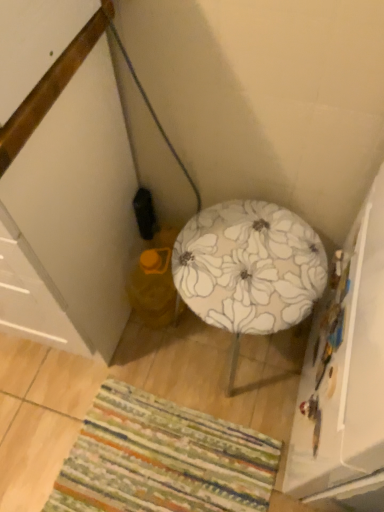
Question: Can you confirm if multicolored woven mat at lower center is thinner than floral fabric stool at center?

Choices:
 (A) yes
 (B) no

Answer: (B)

Question: From the image's perspective, does multicolored woven mat at lower center appear lower than floral fabric stool at center?

Choices:
 (A) yes
 (B) no

Answer: (A)

Question: From a real-world perspective, is multicolored woven mat at lower center on floral fabric stool at center?

Choices:
 (A) yes
 (B) no

Answer: (B)

Question: Is multicolored woven mat at lower center in front of floral fabric stool at center?

Choices:
 (A) no
 (B) yes

Answer: (A)

Question: From a real-world perspective, is multicolored woven mat at lower center under floral fabric stool at center?

Choices:
 (A) yes
 (B) no

Answer: (A)

Question: Do you think floral fabric stool at center is within multicolored woven mat at lower center, or outside of it?

Choices:
 (A) outside
 (B) inside

Answer: (A)

Question: From the image's perspective, is floral fabric stool at center above or below multicolored woven mat at lower center?

Choices:
 (A) above
 (B) below

Answer: (A)

Question: In terms of width, does floral fabric stool at center look wider or thinner when compared to multicolored woven mat at lower center?

Choices:
 (A) thin
 (B) wide

Answer: (A)

Question: In the image, is floral fabric stool at center positioned in front of or behind multicolored woven mat at lower center?

Choices:
 (A) front
 (B) behind

Answer: (A)

Question: From a real-world perspective, relative to floral fabric stool at center, is yellow fabric bean bag chair at lower left vertically above or below?

Choices:
 (A) above
 (B) below

Answer: (B)

Question: Considering the positions of yellow fabric bean bag chair at lower left and floral fabric stool at center in the image, is yellow fabric bean bag chair at lower left wider or thinner than floral fabric stool at center?

Choices:
 (A) thin
 (B) wide

Answer: (A)

Question: In the image, is yellow fabric bean bag chair at lower left positioned in front of or behind floral fabric stool at center?

Choices:
 (A) behind
 (B) front

Answer: (A)

Question: Is yellow fabric bean bag chair at lower left to the left or to the right of floral fabric stool at center in the image?

Choices:
 (A) right
 (B) left

Answer: (B)

Question: Considering the positions of white glossy cabinet at lower left and yellow fabric bean bag chair at lower left in the image, is white glossy cabinet at lower left bigger or smaller than yellow fabric bean bag chair at lower left?

Choices:
 (A) big
 (B) small

Answer: (A)

Question: From their relative heights in the image, would you say white glossy cabinet at lower left is taller or shorter than yellow fabric bean bag chair at lower left?

Choices:
 (A) tall
 (B) short

Answer: (A)